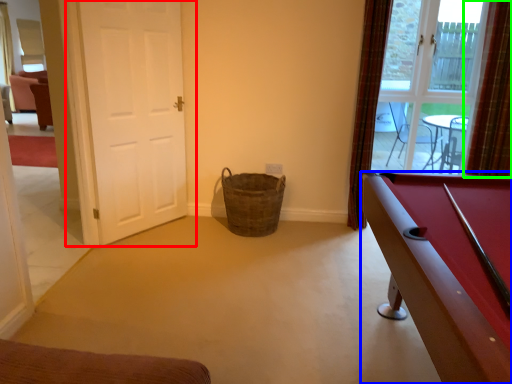
Question: Considering the real-world distances, which object is closest to door (highlighted by a red box)? billiard table (highlighted by a blue box) or curtain (highlighted by a green box).

Choices:
 (A) billiard table
 (B) curtain

Answer: (A)